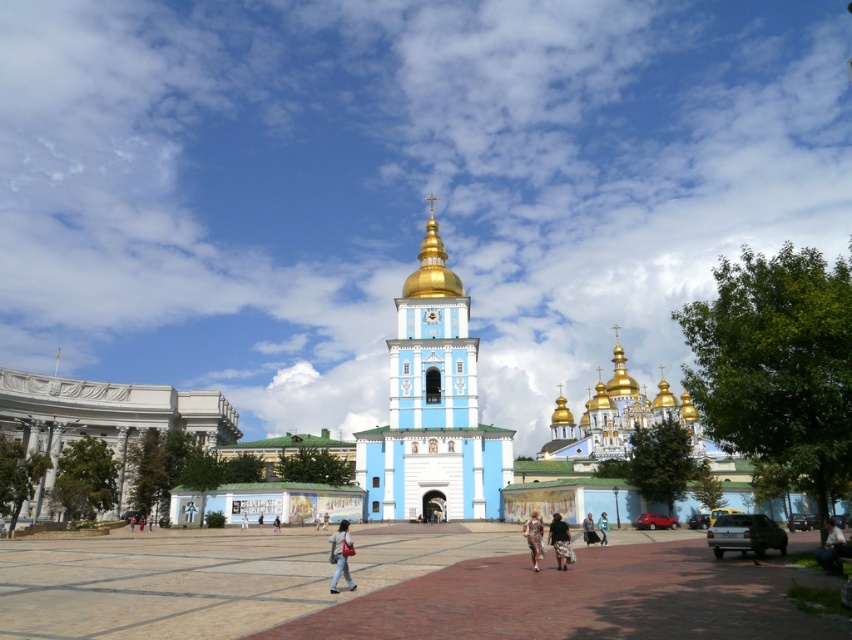
Question: Is the position of white marble building at left more distant than that of floral dress at center?

Choices:
 (A) yes
 (B) no

Answer: (A)

Question: Considering the real-world distances, which object is farthest from the denim jacket at lower center?

Choices:
 (A) gold domed church at center
 (B) brick pavement at center
 (C) white marble building at left

Answer: (A)

Question: Based on their relative distances, which object is nearer to the light blue denim jacket at center?

Choices:
 (A) floral dress at center
 (B) dark gray fabric pants at center

Answer: (B)

Question: Which object is positioned closest to the light brown woven skirt at center?

Choices:
 (A) white marble building at left
 (B) blue painted stone tower at center

Answer: (B)

Question: Is blue painted stone tower at center wider than light blue denim jacket at center?

Choices:
 (A) no
 (B) yes

Answer: (B)

Question: Can you confirm if denim jacket at lower center is thinner than dark gray fabric pants at center?

Choices:
 (A) yes
 (B) no

Answer: (B)